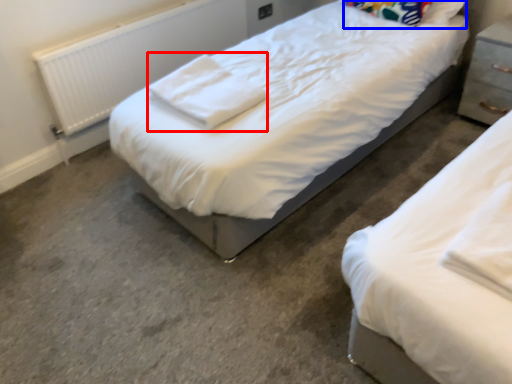
Question: Which object is closer to the camera taking this photo, cloth (highlighted by a red box) or pillow (highlighted by a blue box)?

Choices:
 (A) cloth
 (B) pillow

Answer: (A)